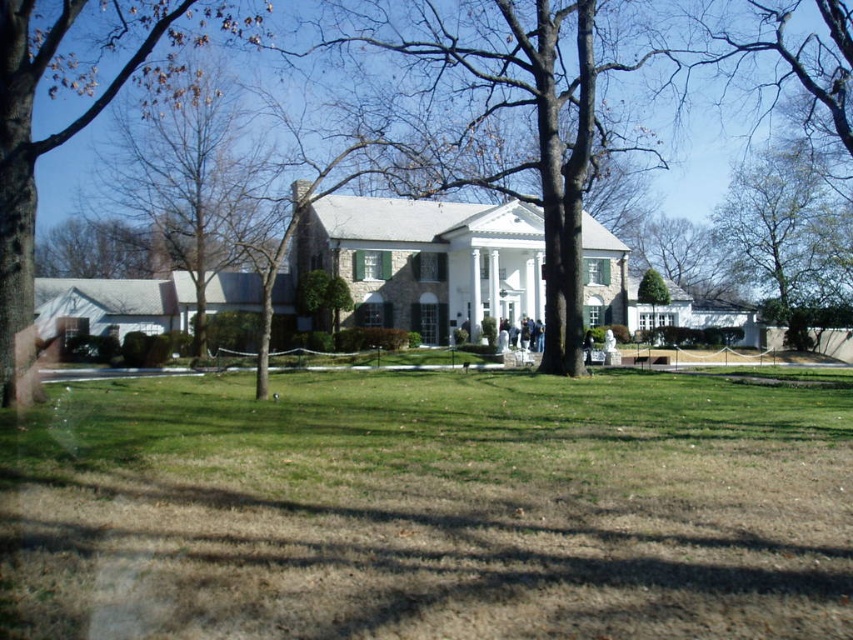
Question: Can you confirm if green grass at center is positioned to the left of green leafy tree at center?

Choices:
 (A) no
 (B) yes

Answer: (B)

Question: Which object is farther from the camera taking this photo?

Choices:
 (A) green leafy tree at center
 (B) brown leafy tree at upper left
 (C) green grass at center

Answer: (A)

Question: Which object is farther from the camera taking this photo?

Choices:
 (A) brown leafy tree at upper left
 (B) green grass at center

Answer: (A)

Question: Considering the relative positions of green leafy tree at center and green leafy tree at upper right in the image provided, where is green leafy tree at center located with respect to green leafy tree at upper right?

Choices:
 (A) above
 (B) below

Answer: (A)

Question: Estimate the real-world distances between objects in this image. Which object is closer to the green grass at center?

Choices:
 (A) green leafy tree at center
 (B) brown leafy tree at upper left
 (C) green leafy tree at upper right

Answer: (B)

Question: Is brown leafy tree at upper left to the right of green leafy tree at upper right from the viewer's perspective?

Choices:
 (A) no
 (B) yes

Answer: (A)